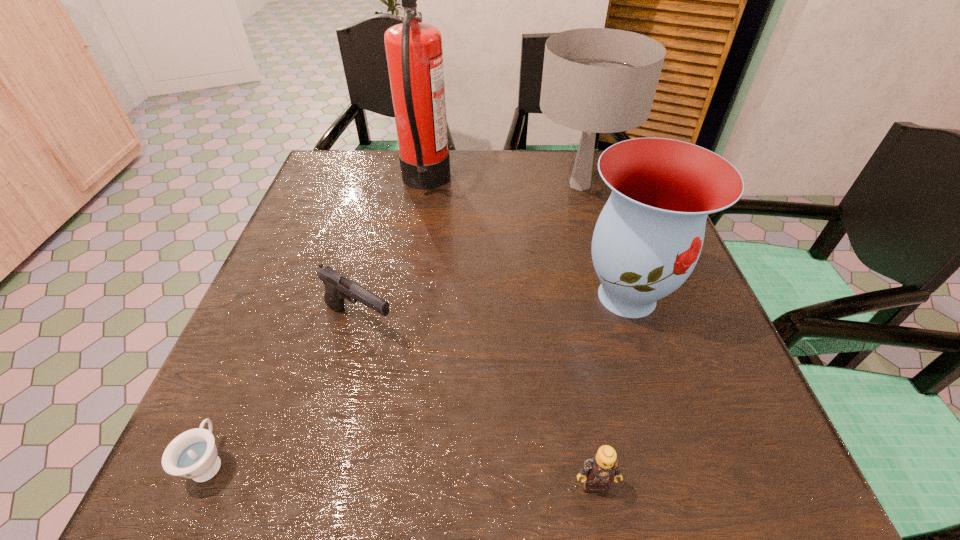
This screenshot has height=540, width=960. I want to click on fire extinguisher, so click(414, 52).

The width and height of the screenshot is (960, 540). In order to click on the fifth shortest object in this screenshot , I will do [596, 80].

Identify the location of vase. The image size is (960, 540). (648, 238).

You are a GUI agent. You are given a task and a screenshot of the screen. Output one action in this format:
    pyautogui.click(x=<x>, y=<y>)
    Task: Click on the gun
    This screenshot has width=960, height=540.
    Given the screenshot: What is the action you would take?
    pyautogui.click(x=337, y=286)

Locate an element on the screen. Lego is located at coordinates (600, 469).

You are a GUI agent. You are given a task and a screenshot of the screen. Output one action in this format:
    pyautogui.click(x=<x>, y=<y>)
    Task: Click on the leftmost object
    Image resolution: width=960 pixels, height=540 pixels.
    Given the screenshot: What is the action you would take?
    pyautogui.click(x=193, y=454)

Identify the location of teacup. (193, 454).

Locate an element on the screen. This screenshot has width=960, height=540. free space located on the front-facing side of the fire extinguisher is located at coordinates (484, 183).

Image resolution: width=960 pixels, height=540 pixels. Find the location of `free space located on the front-facing side of the lampshade`. free space located on the front-facing side of the lampshade is located at coordinates (x=612, y=295).

This screenshot has width=960, height=540. What are the coordinates of `free space located 0.130m on the left of the fourth shortest object` in the screenshot? It's located at (507, 296).